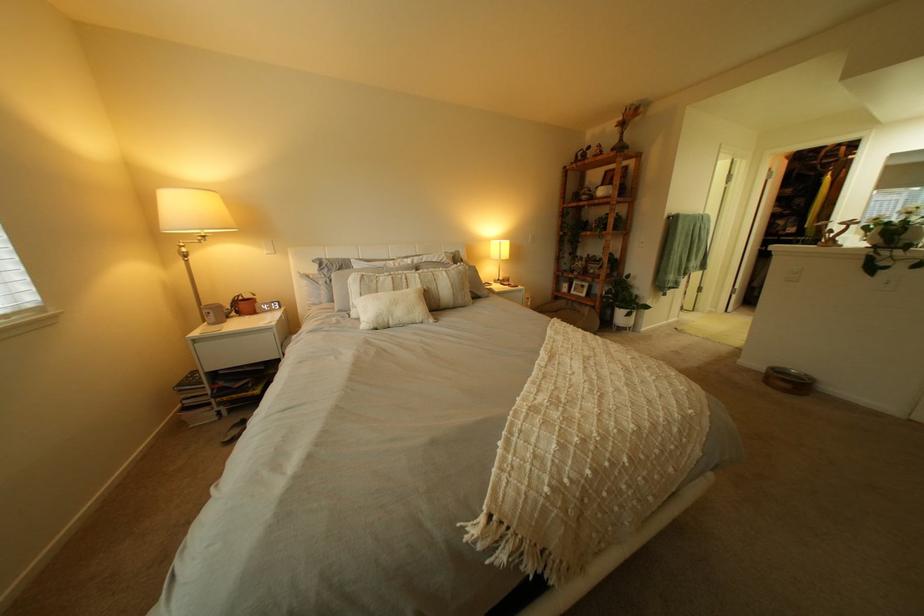
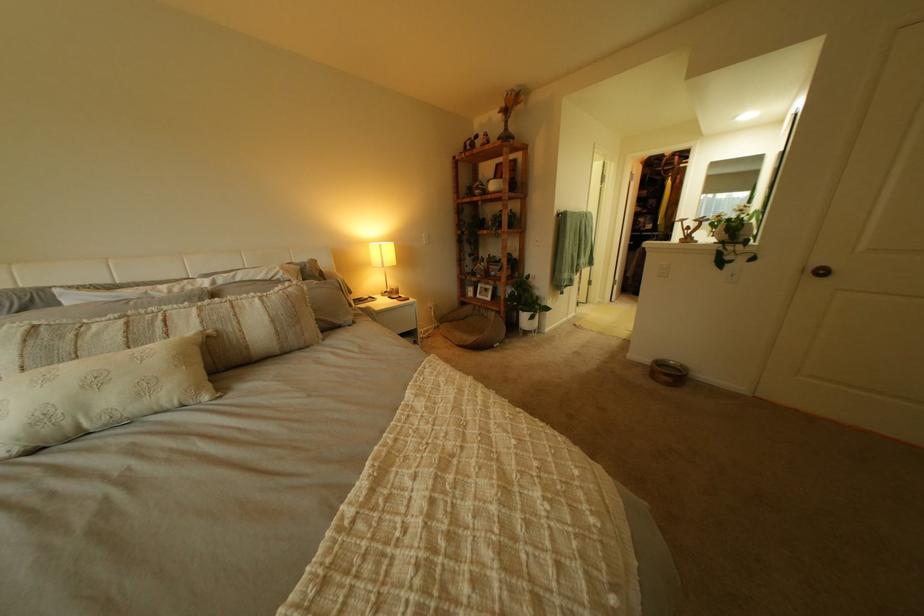
The images are taken continuously from a first-person perspective. In which direction are you moving?

The movement direction of the cameraman is right, forward.